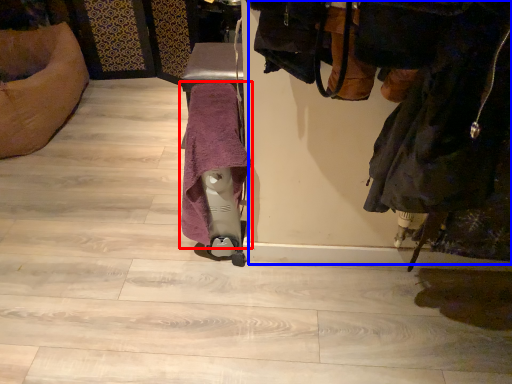
Question: Which point is further to the camera, bath towel (highlighted by a red box) or laundry (highlighted by a blue box)?

Choices:
 (A) bath towel
 (B) laundry

Answer: (A)